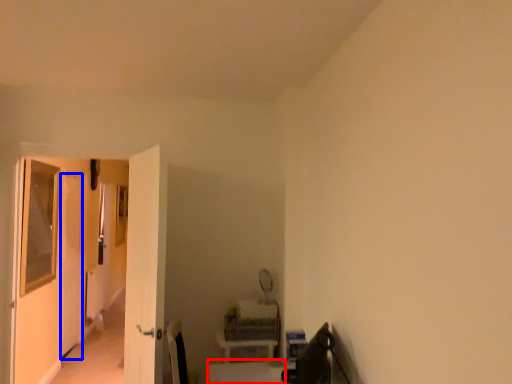
Question: Which object is further to the camera taking this photo, table (highlighted by a red box) or screen door (highlighted by a blue box)?

Choices:
 (A) table
 (B) screen door

Answer: (B)